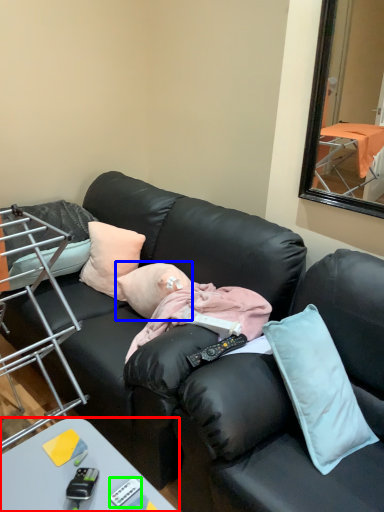
Question: Based on their relative distances, which object is farther from desk (highlighted by a red box)? Choose from person (highlighted by a blue box) and remote control (highlighted by a green box).

Choices:
 (A) person
 (B) remote control

Answer: (A)